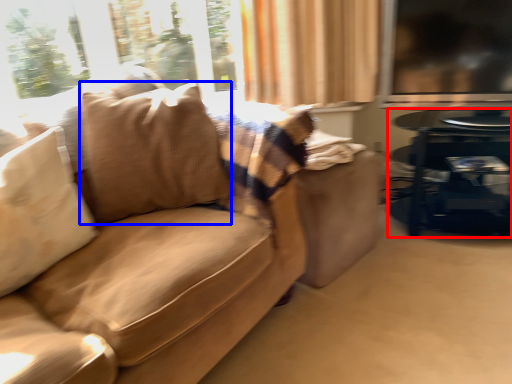
Question: Which object is further to the camera taking this photo, table (highlighted by a red box) or throw pillow (highlighted by a blue box)?

Choices:
 (A) table
 (B) throw pillow

Answer: (A)